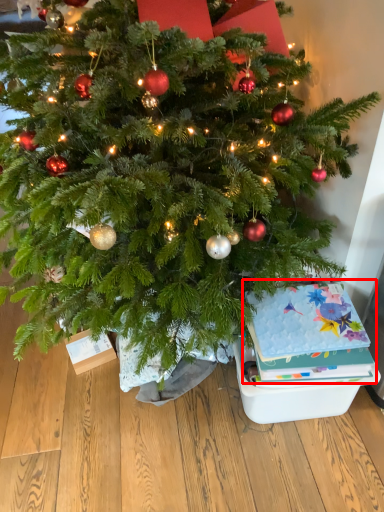
Question: From the image's perspective, what is the correct spatial positioning of christmas card (annotated by the red box) in reference to storage box?

Choices:
 (A) below
 (B) above

Answer: (B)